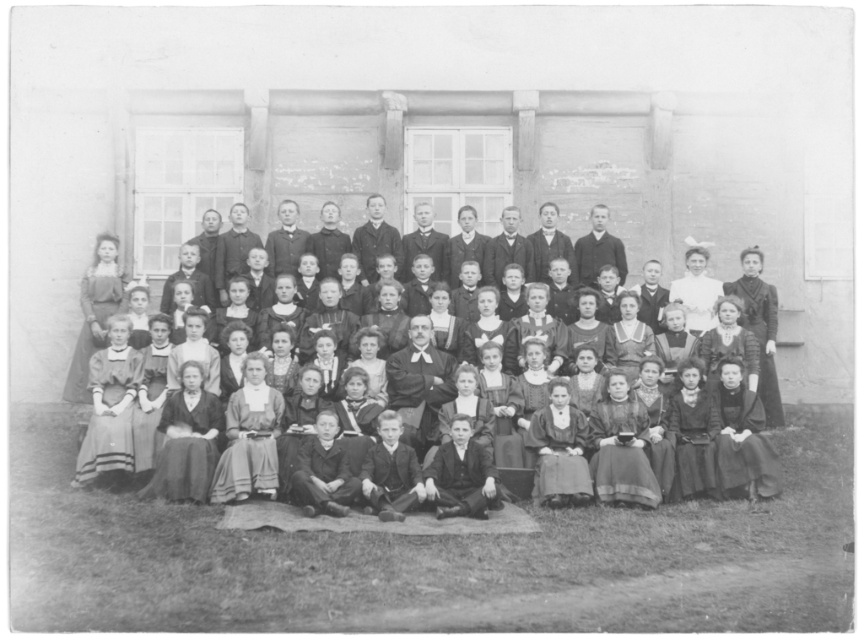
Is matte brown dress at upper left smaller than matte black dress at upper right?

Correct, matte brown dress at upper left occupies less space than matte black dress at upper right.

Which is below, matte brown dress at upper left or matte black dress at upper right?

matte black dress at upper right is below.

I want to click on matte brown dress at upper left, so click(94, 312).

What do you see at coordinates (759, 326) in the screenshot? This screenshot has height=640, width=864. I see `matte black dress at upper right` at bounding box center [759, 326].

Does matte black dress at upper right have a greater width compared to white satin blouse at upper center?

No, matte black dress at upper right is not wider than white satin blouse at upper center.

This screenshot has width=864, height=640. Identify the location of matte black dress at upper right. (759, 326).

Can you confirm if matte brown dress at upper left is bigger than white satin blouse at upper center?

Indeed, matte brown dress at upper left has a larger size compared to white satin blouse at upper center.

Is point (105, 236) less distant than point (687, 305)?

No, (105, 236) is further to viewer.

Where is `matte brown dress at upper left`? matte brown dress at upper left is located at coordinates (94, 312).